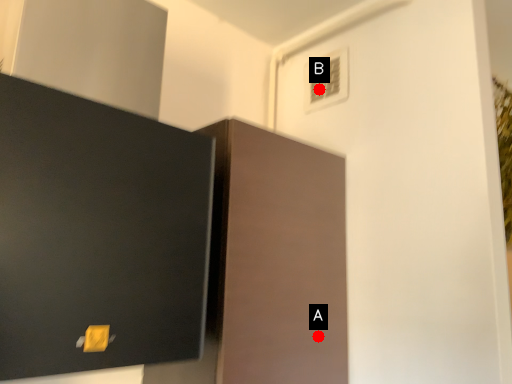
Question: Two points are circled on the image, labeled by A and B beside each circle. Which of the following is the farthest from the observer?

Choices:
 (A) A is further
 (B) B is further

Answer: (B)